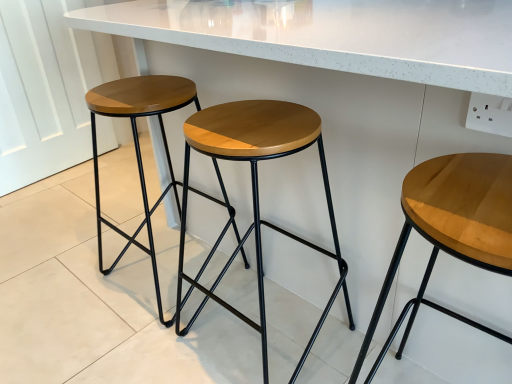
Locate an element on the screen. The height and width of the screenshot is (384, 512). vacant region to the left of wooden/matte stool at center, which is counted as the 2th stool, starting from the right is located at coordinates (146, 346).